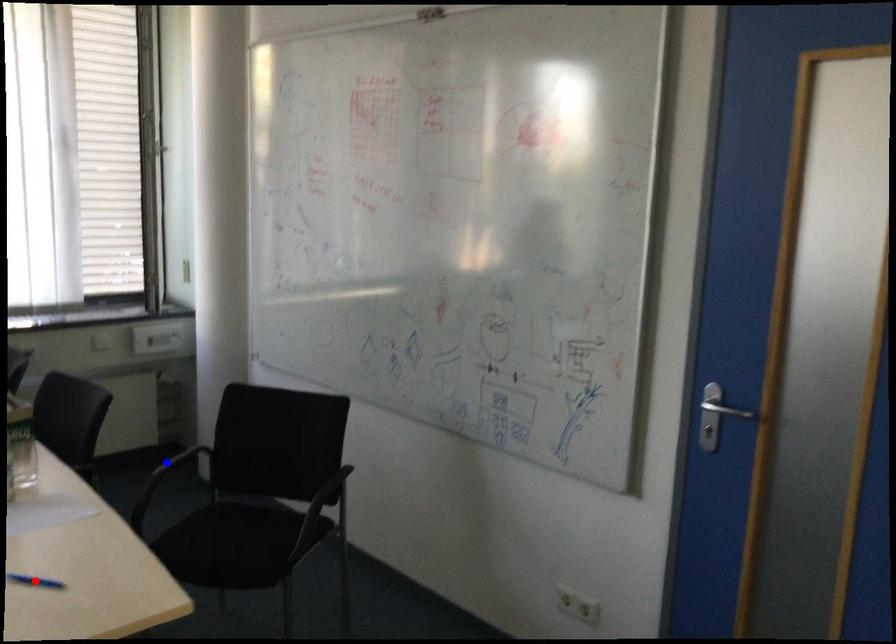
Question: In the image, two points are highlighted. Which point is nearer to the camera? Reply with the corresponding letter.

Choices:
 (A) blue point
 (B) red point

Answer: (B)